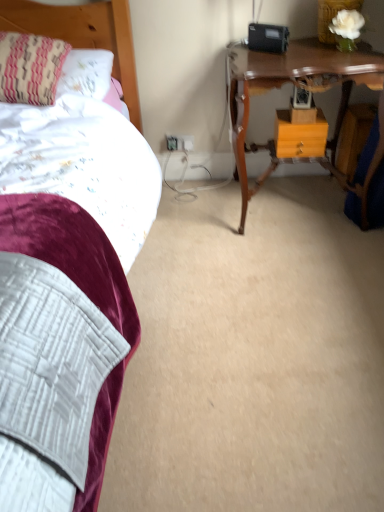
Question: Would you say orange matte drawer at center is to the left or to the right of wooden table at upper right in the picture?

Choices:
 (A) right
 (B) left

Answer: (A)

Question: Which is correct: orange matte drawer at center is inside wooden table at upper right, or outside of it?

Choices:
 (A) inside
 (B) outside

Answer: (A)

Question: Estimate the real-world distances between objects in this image. Which object is farther from the orange matte drawer at center?

Choices:
 (A) wooden table at upper right
 (B) wooden headboard at upper left
 (C) striped fabric pillow at upper left

Answer: (C)

Question: Based on their relative distances, which object is farther from the wooden table at upper right?

Choices:
 (A) striped fabric pillow at upper left
 (B) wooden headboard at upper left
 (C) orange matte drawer at center

Answer: (A)